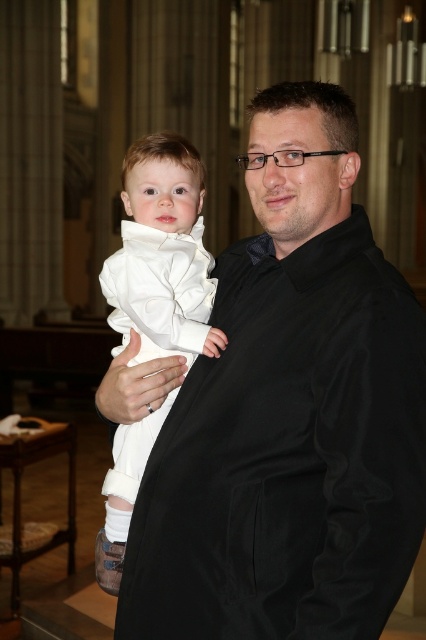
Does black satin coat at center have a greater width compared to white satin baby at center?

Indeed, black satin coat at center has a greater width compared to white satin baby at center.

What do you see at coordinates (284, 413) in the screenshot? The width and height of the screenshot is (426, 640). I see `black satin coat at center` at bounding box center [284, 413].

Is point (287, 506) closer to viewer compared to point (204, 248)?

Yes.

Where is `black satin coat at center`? black satin coat at center is located at coordinates [x=284, y=413].